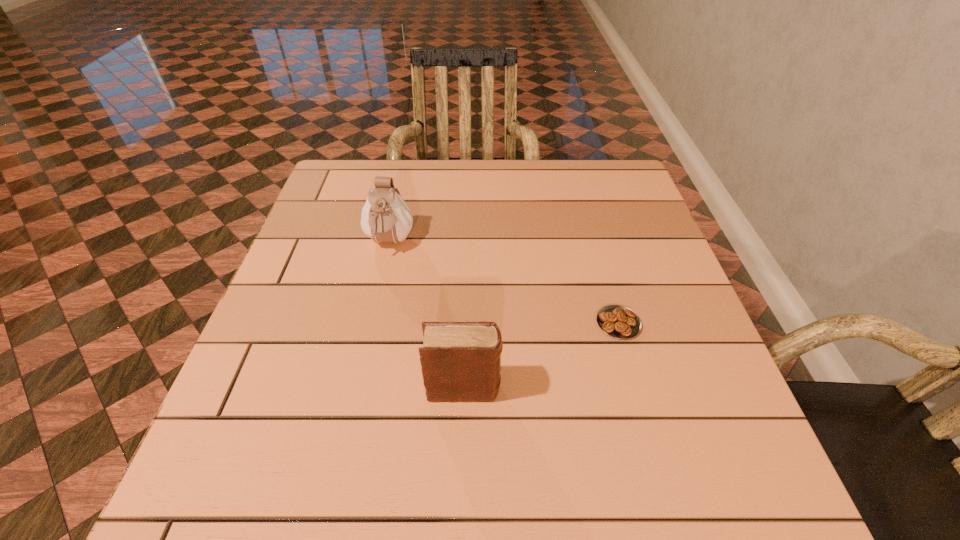
Identify the location of free space that satisfies the following two spatial constraints: 1. on the front-facing side of the farthest object; 2. on the left side of the second farthest object. This screenshot has height=540, width=960. (372, 323).